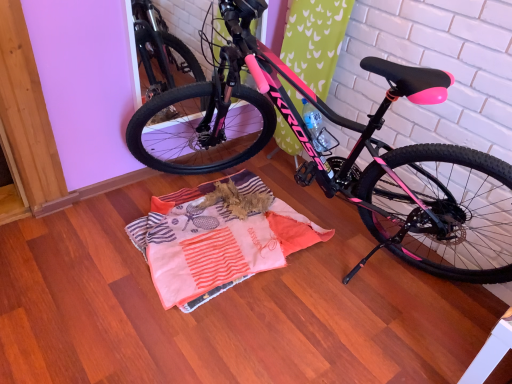
Find the location of a particular element. The image size is (512, 384). vacant position to the left of striped cotton blanket at center is located at coordinates (82, 243).